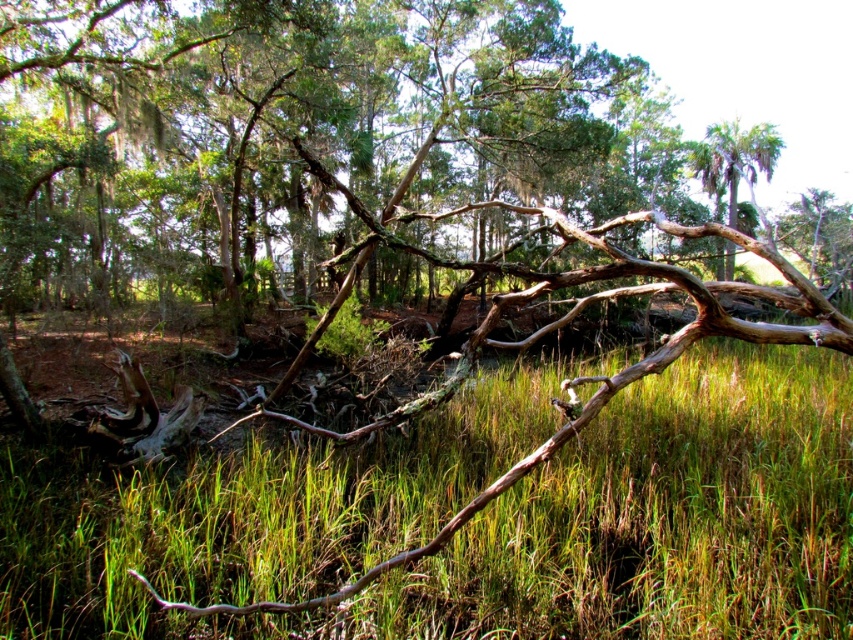
Question: Is green matte grass at center positioned before green leafy palm tree at upper right?

Choices:
 (A) yes
 (B) no

Answer: (A)

Question: Is green matte grass at center positioned before green leafy palm tree at upper right?

Choices:
 (A) no
 (B) yes

Answer: (B)

Question: Which point appears farthest from the camera in this image?

Choices:
 (A) (735, 216)
 (B) (10, 614)

Answer: (A)

Question: Where is green matte grass at center located in relation to green leafy palm tree at upper right in the image?

Choices:
 (A) right
 (B) left

Answer: (B)